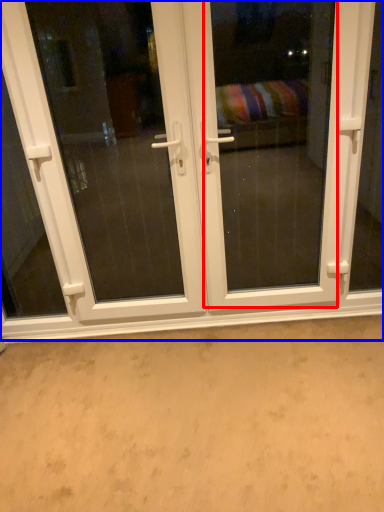
Question: Which point is closer to the camera, screen door (highlighted by a red box) or door (highlighted by a blue box)?

Choices:
 (A) screen door
 (B) door

Answer: (A)